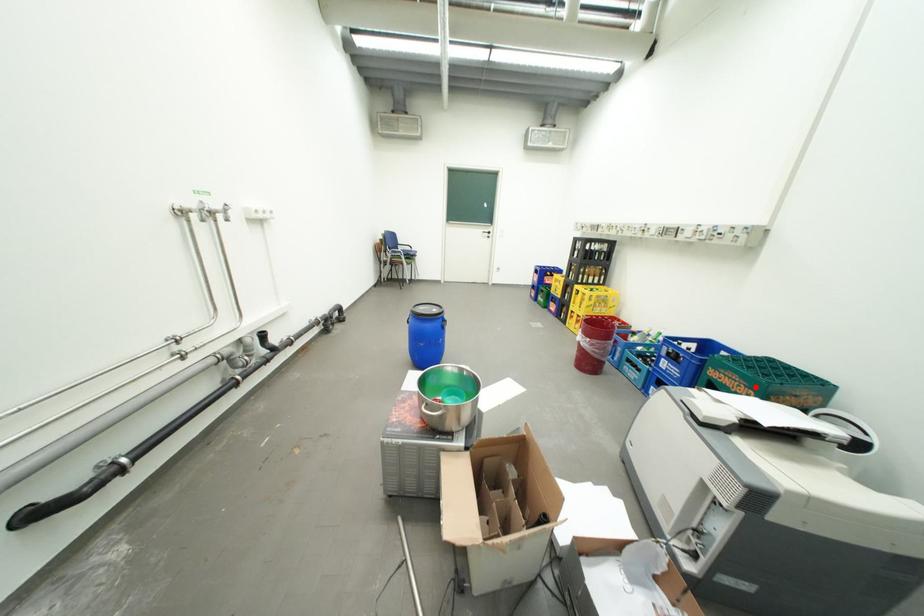
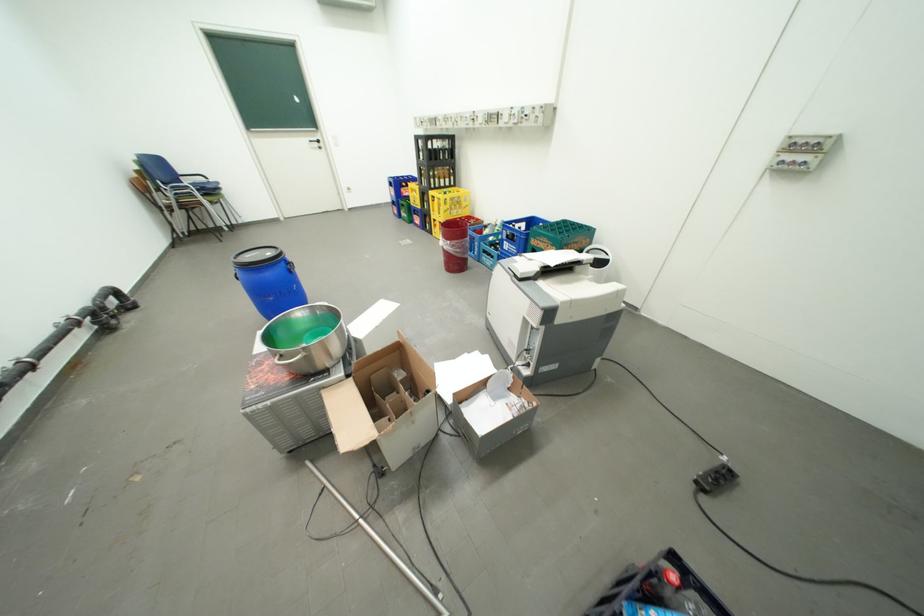
Question: I am providing you with two images of the same scene from different viewpoints. A red point is shown in image1. For the corresponding object point in image2, is it positioned nearer or farther from the camera?

Choices:
 (A) Nearer
 (B) Farther

Answer: (B)